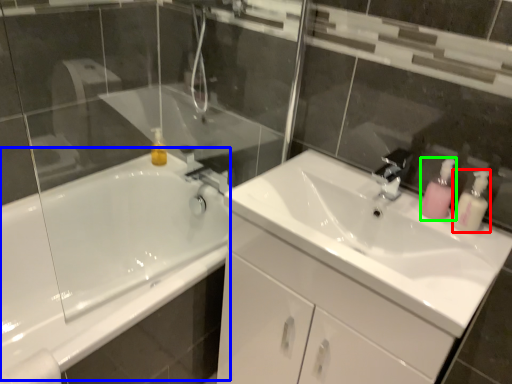
Question: Which is farther away from soap dispenser (highlighted by a red box)? bath (highlighted by a blue box) or soap dispenser (highlighted by a green box)?

Choices:
 (A) bath
 (B) soap dispenser

Answer: (A)